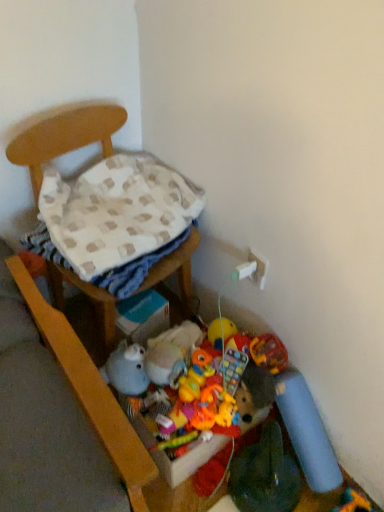
Question: Can you confirm if rubberized plastic toy at center, which ranks as the second toy in right-to-left order, is positioned to the right of fuzzy fabric stuffed animal at lower center, the 3th toy when ordered from bottom to top?

Choices:
 (A) yes
 (B) no

Answer: (A)

Question: Considering the relative positions of rubberized plastic toy at center, which ranks as the second toy in right-to-left order, and fuzzy fabric stuffed animal at lower center, the 3th toy when ordered from bottom to top, in the image provided, is rubberized plastic toy at center, which ranks as the second toy in right-to-left order, to the left of fuzzy fabric stuffed animal at lower center, the 3th toy when ordered from bottom to top, from the viewer's perspective?

Choices:
 (A) no
 (B) yes

Answer: (A)

Question: Considering the relative positions of rubberized plastic toy at center, which appears as the 3th toy when viewed from the left, and fuzzy fabric stuffed animal at lower center, which is the fourth toy in right-to-left order, in the image provided, is rubberized plastic toy at center, which appears as the 3th toy when viewed from the left, behind fuzzy fabric stuffed animal at lower center, which is the fourth toy in right-to-left order,?

Choices:
 (A) no
 (B) yes

Answer: (B)

Question: Does rubberized plastic toy at center, which ranks as the second toy in right-to-left order, lie in front of fuzzy fabric stuffed animal at lower center, the 3th toy when ordered from bottom to top?

Choices:
 (A) no
 (B) yes

Answer: (A)

Question: From the image's perspective, would you say rubberized plastic toy at center, which appears as the 3th toy when viewed from the left, is shown under fuzzy fabric stuffed animal at lower center, which is the fourth toy in right-to-left order?

Choices:
 (A) yes
 (B) no

Answer: (A)

Question: Is point (220, 323) closer or farther from the camera than point (122, 216)?

Choices:
 (A) farther
 (B) closer

Answer: (A)

Question: Choose the correct answer: Is soft plush duck at lower center, the 1th toy from the top, inside beige checkered blanket at left or outside it?

Choices:
 (A) outside
 (B) inside

Answer: (A)

Question: Is soft plush duck at lower center, the 1th toy from the top, in front of or behind beige checkered blanket at left in the image?

Choices:
 (A) front
 (B) behind

Answer: (B)

Question: Looking at the image, does soft plush duck at lower center, placed as the 3th toy when sorted from right to left, seem bigger or smaller compared to beige checkered blanket at left?

Choices:
 (A) small
 (B) big

Answer: (A)

Question: From a real-world perspective, relative to soft plush duck at lower center, acting as the 2th toy starting from the left, is rubberized plastic toy at center, marked as the second toy in a bottom-to-top arrangement, vertically above or below?

Choices:
 (A) above
 (B) below

Answer: (A)

Question: Is rubberized plastic toy at center, which appears as the 3th toy when viewed from the left, inside the boundaries of soft plush duck at lower center, marked as the 4th toy in a bottom-to-top arrangement, or outside?

Choices:
 (A) inside
 (B) outside

Answer: (B)

Question: Considering the relative positions of rubberized plastic toy at center, which appears as the 3th toy when viewed from the left, and soft plush duck at lower center, placed as the 3th toy when sorted from right to left, in the image provided, is rubberized plastic toy at center, which appears as the 3th toy when viewed from the left, to the left or to the right of soft plush duck at lower center, placed as the 3th toy when sorted from right to left,?

Choices:
 (A) left
 (B) right

Answer: (B)

Question: Considering the positions of rubberized plastic toy at center, which ranks as the second toy in right-to-left order, and soft plush duck at lower center, the 1th toy from the top, in the image, is rubberized plastic toy at center, which ranks as the second toy in right-to-left order, taller or shorter than soft plush duck at lower center, the 1th toy from the top,?

Choices:
 (A) short
 (B) tall

Answer: (B)

Question: From a real-world perspective, is soft plush toy at lower right, the 4th toy positioned from the top, positioned above or below rubberized plastic toy at center, marked as the second toy in a bottom-to-top arrangement?

Choices:
 (A) below
 (B) above

Answer: (A)

Question: Considering the positions of soft plush toy at lower right, positioned as the 1th toy in right-to-left order, and rubberized plastic toy at center, the third toy viewed from the top, in the image, is soft plush toy at lower right, positioned as the 1th toy in right-to-left order, wider or thinner than rubberized plastic toy at center, the third toy viewed from the top,?

Choices:
 (A) wide
 (B) thin

Answer: (A)